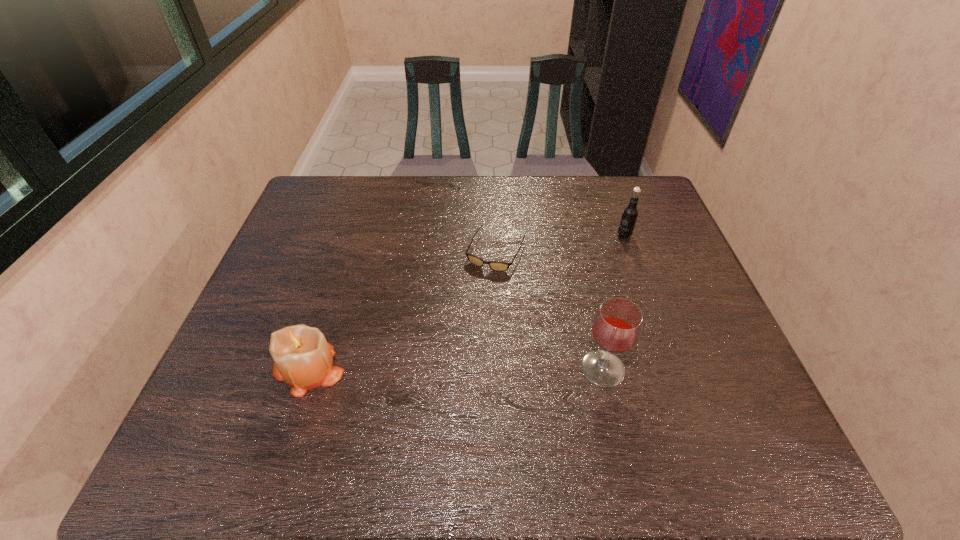
Identify the location of empty space that is in between the third object from left to right and the leftmost object. (455, 369).

The height and width of the screenshot is (540, 960). I want to click on free point between the leftmost object and the third object from right to left, so click(x=402, y=310).

Identify which object is the closest to the candle. Please provide its 2D coordinates. Your answer should be formatted as a tuple, i.e. [(x, y)], where the tuple contains the x and y coordinates of a point satisfying the conditions above.

[(494, 265)]

Where is `object that stands as the closest to the wineglass`? The width and height of the screenshot is (960, 540). object that stands as the closest to the wineglass is located at coordinates pos(494,265).

Identify the location of vacant space that satisfies the following two spatial constraints: 1. on the back side of the leftmost object; 2. on the right side of the root beer. (351, 235).

Find the location of a particular element. This screenshot has height=540, width=960. free space in the image that satisfies the following two spatial constraints: 1. on the front side of the wineglass; 2. on the right side of the shortest object is located at coordinates (500, 368).

Where is `vacant area in the image that satisfies the following two spatial constraints: 1. on the front side of the wineglass; 2. on the right side of the sunglasses`? This screenshot has height=540, width=960. vacant area in the image that satisfies the following two spatial constraints: 1. on the front side of the wineglass; 2. on the right side of the sunglasses is located at coordinates (500, 368).